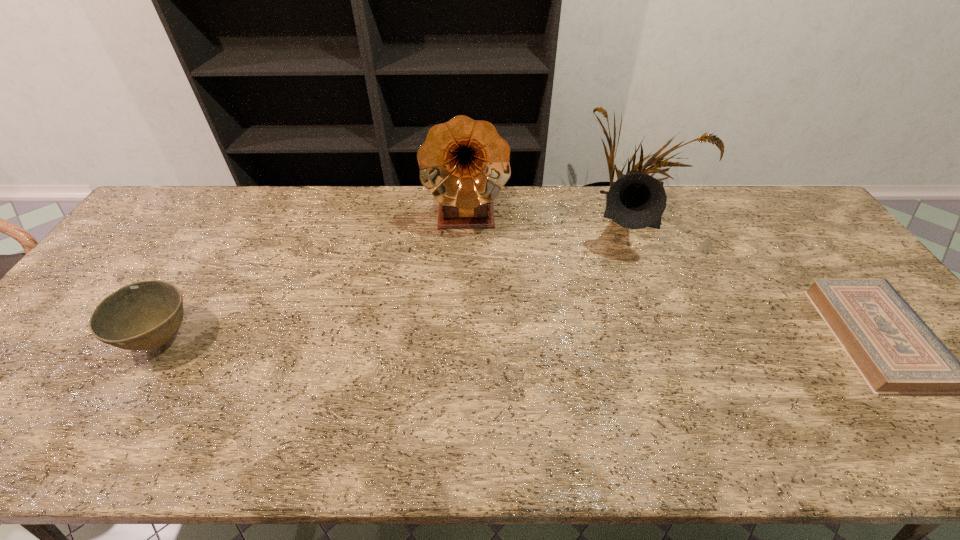
Identify the location of free spot on the desktop that is between the leftmost object and the shortest object and is positioned from the horn of the third object from left to right. This screenshot has height=540, width=960. (608, 338).

The image size is (960, 540). I want to click on free spot on the desktop that is between the leftmost object and the Bible and is positioned on the horn of the second object from left to right, so click(468, 339).